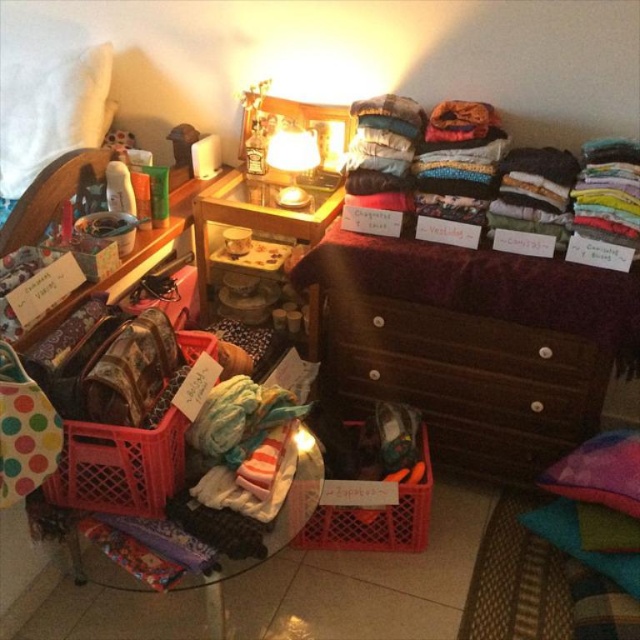
From the picture: You are trying to decide whether to place a tall plant in the corner of the room. You see the translucent plastic basket at lower left and the matte glass lamp at upper center. Which object is taller so that the plant might need to be placed elsewhere?

The translucent plastic basket at lower left is taller than the matte glass lamp at upper center, so the plant might need to be placed elsewhere to avoid blocking the basket.